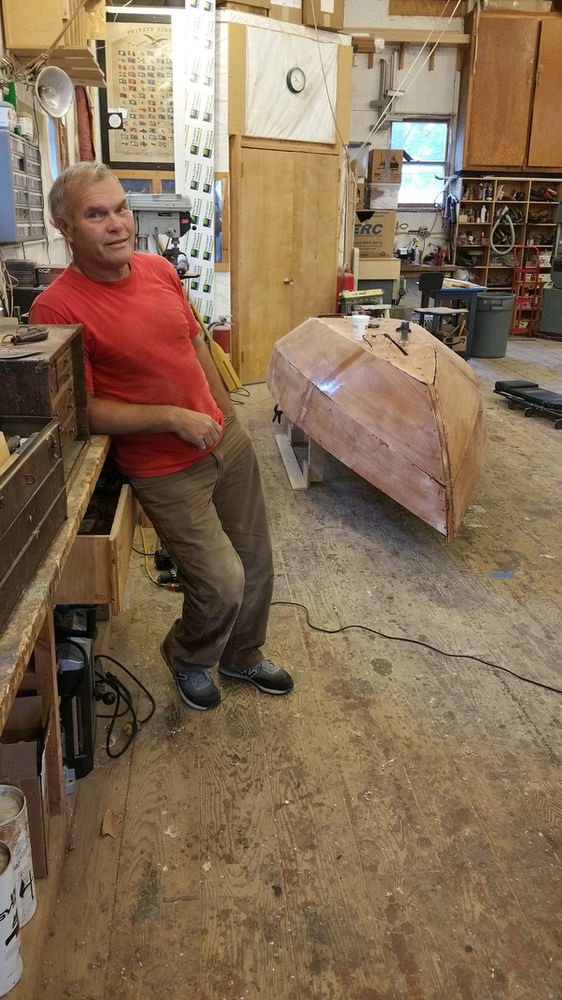
Locate an element on the screen. The image size is (562, 1000). trash is located at coordinates (492, 316).